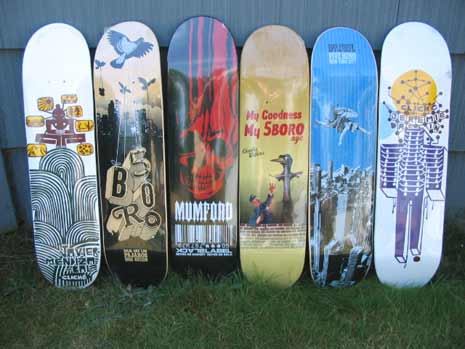
Where is `blue wall`? blue wall is located at coordinates (125, 10).